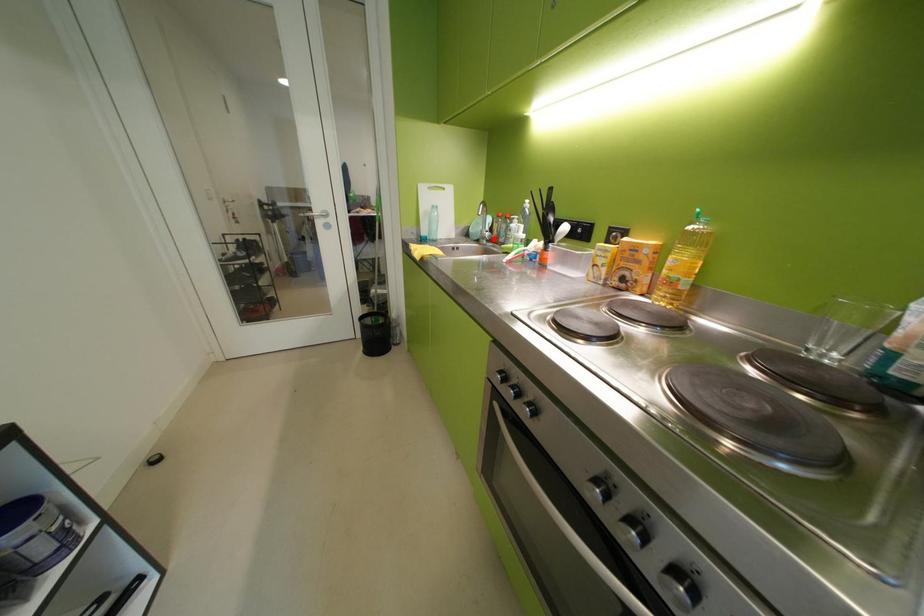
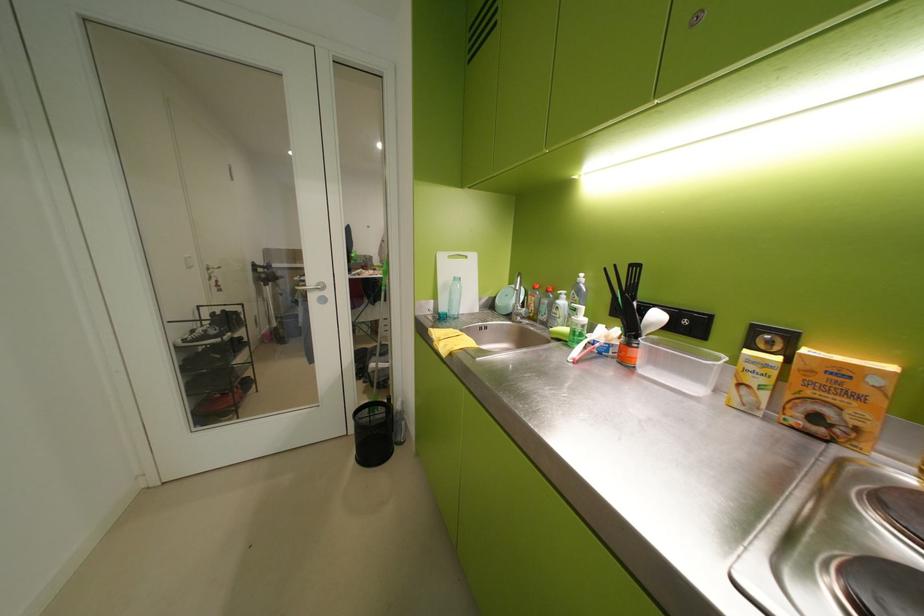
Locate, in the second image, the point that corresponds to the highlighted location in the first image.

(529, 315)